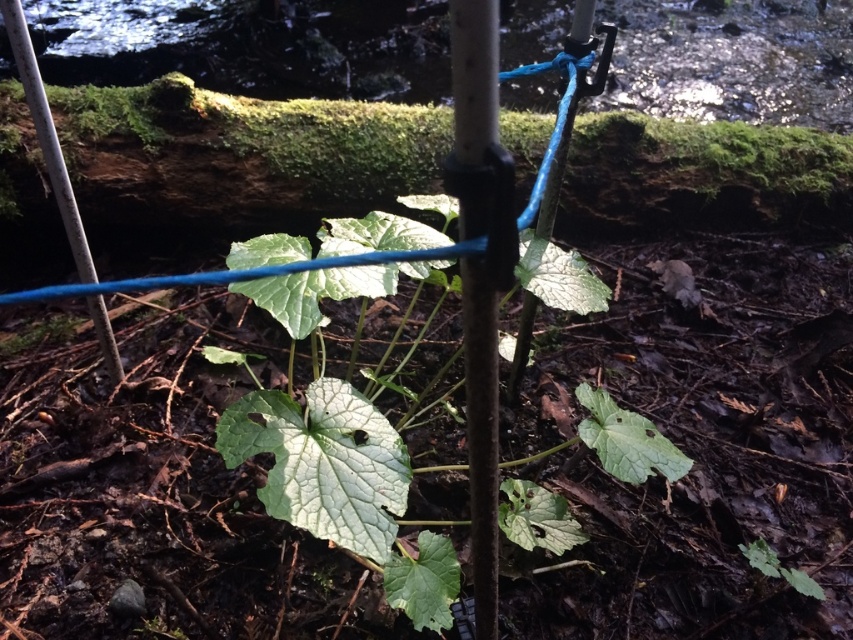
Can you confirm if green matte leafy plant at center is shorter than smooth white pole at center?

In fact, green matte leafy plant at center may be taller than smooth white pole at center.

Is green matte leafy plant at center to the right of smooth white pole at center from the viewer's perspective?

Incorrect, green matte leafy plant at center is not on the right side of smooth white pole at center.

Does point (363, 444) lie in front of point (466, 84)?

No.

You are a GUI agent. You are given a task and a screenshot of the screen. Output one action in this format:
    pyautogui.click(x=<x>, y=<y>)
    Task: Click on the green matte leafy plant at center
    
    Given the screenshot: What is the action you would take?
    pyautogui.click(x=345, y=483)

Is point (425, 522) less distant than point (109, 376)?

Yes.

How much distance is there between green matte leafy plant at center and white matte pole at left?

green matte leafy plant at center is 28.83 inches from white matte pole at left.

This screenshot has width=853, height=640. I want to click on green matte leafy plant at center, so click(x=345, y=483).

Is smooth white pole at center further to the viewer compared to white matte pole at left?

No, smooth white pole at center is closer to the viewer.

In the scene shown: Does smooth white pole at center come in front of white matte pole at left?

Yes, it is.

Between point (480, 564) and point (85, 256), which one is positioned behind?

The point (85, 256) is more distant.

Where is `smooth white pole at center`? This screenshot has width=853, height=640. smooth white pole at center is located at coordinates coord(482,442).